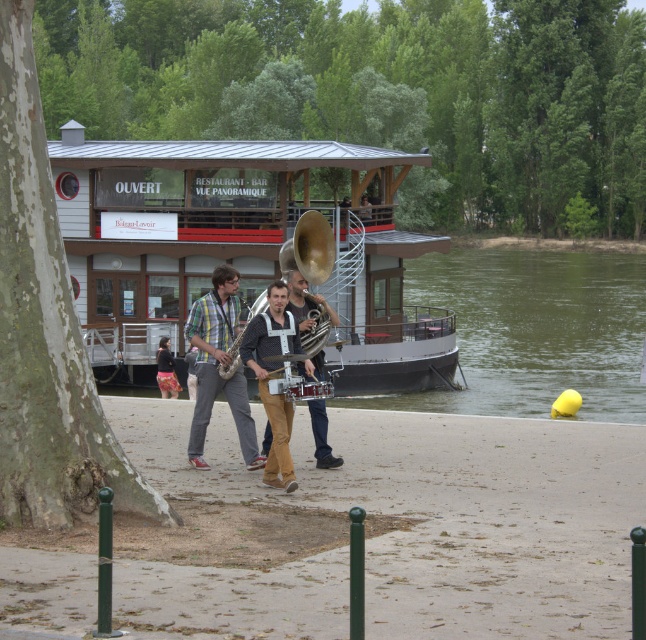
Is plaid fabric shirt at center taller than shiny silver saxophone at center?

Correct, plaid fabric shirt at center is much taller as shiny silver saxophone at center.

Does plaid fabric shirt at center appear over shiny silver saxophone at center?

Incorrect, plaid fabric shirt at center is not positioned above shiny silver saxophone at center.

The image size is (646, 640). What do you see at coordinates (216, 365) in the screenshot? I see `plaid fabric shirt at center` at bounding box center [216, 365].

Locate an element on the screen. plaid fabric shirt at center is located at coordinates (216, 365).

Does plaid fabric shirt at center lie behind floral skirt at center?

No, plaid fabric shirt at center is in front of floral skirt at center.

Who is lower down, plaid fabric shirt at center or floral skirt at center?

floral skirt at center

At what (x,y) coordinates should I click in order to perform the action: click on plaid fabric shirt at center. Please return your answer as a coordinate pair (x, y). Image resolution: width=646 pixels, height=640 pixels. Looking at the image, I should click on (216, 365).

Does plaid fabric shirt at center appear on the right side of matte black saxophone at center?

No, plaid fabric shirt at center is not to the right of matte black saxophone at center.

What do you see at coordinates (216, 365) in the screenshot? I see `plaid fabric shirt at center` at bounding box center [216, 365].

This screenshot has height=640, width=646. Identify the location of plaid fabric shirt at center. (216, 365).